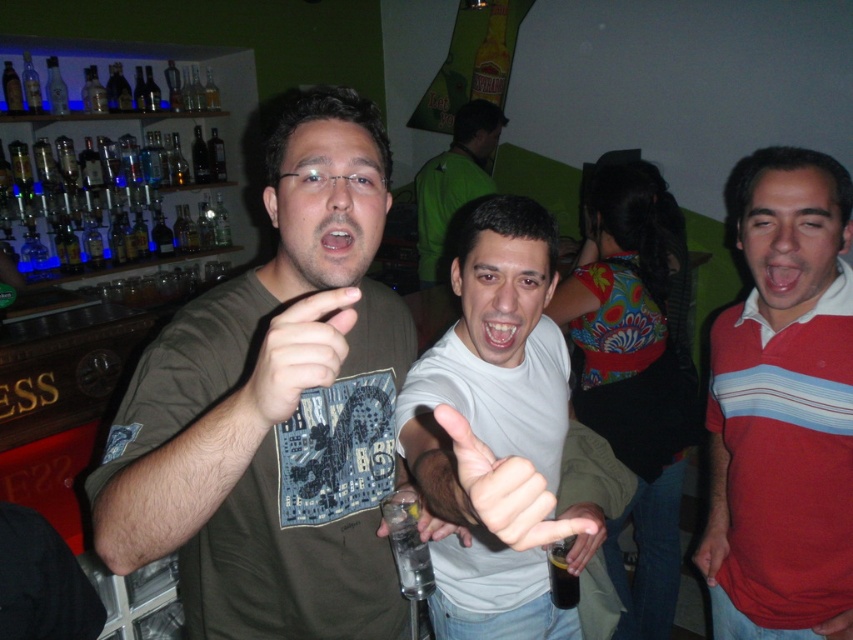
Question: Does white matte shirt at center appear over matte green shirt at center?

Choices:
 (A) no
 (B) yes

Answer: (A)

Question: Observing the image, what is the correct spatial positioning of white matte shirt at center in reference to matte green shirt at center?

Choices:
 (A) right
 (B) left

Answer: (A)

Question: Which object is closer to the camera taking this photo?

Choices:
 (A) red striped polo shirt at upper right
 (B) matte brown t-shirt at center
 (C) matte green shirt at center

Answer: (C)

Question: Which of the following is the farthest from the observer?

Choices:
 (A) (572, 548)
 (B) (444, 240)

Answer: (B)

Question: Is matte brown t-shirt at center bigger than matte plastic bottle at lower center?

Choices:
 (A) yes
 (B) no

Answer: (A)

Question: Among these objects, which one is nearest to the camera?

Choices:
 (A) matte brown t-shirt at center
 (B) gray matte hand at center
 (C) matte plastic bottle at lower center
 (D) green matte shirt at center

Answer: (B)